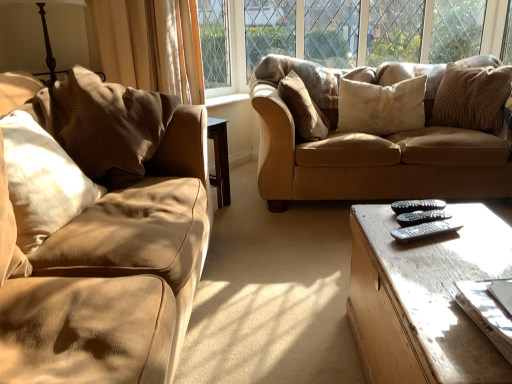
Where is `vacant space in front of black plastic remote at center, which ranks as the 2th remote in back-to-front order`? The width and height of the screenshot is (512, 384). vacant space in front of black plastic remote at center, which ranks as the 2th remote in back-to-front order is located at coordinates (448, 248).